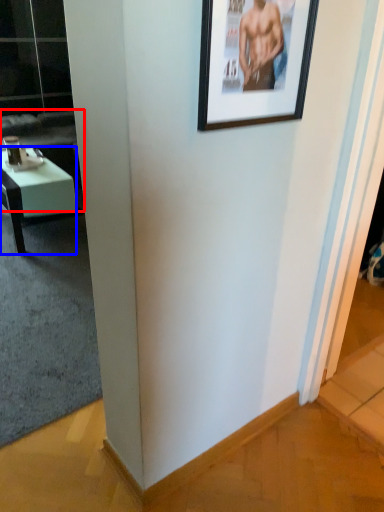
Question: Which object appears closest to the camera in this image, couch (highlighted by a red box) or desk (highlighted by a blue box)?

Choices:
 (A) couch
 (B) desk

Answer: (B)